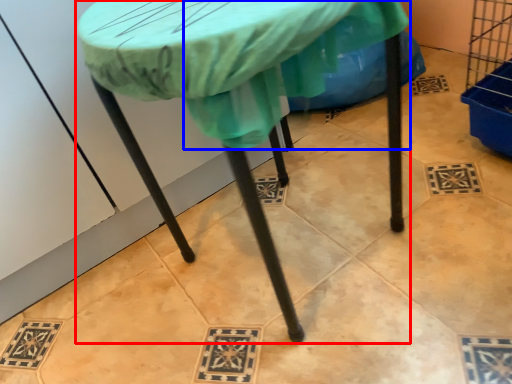
Question: Which of the following is the farthest to the observer, table (highlighted by a red box) or fabric (highlighted by a blue box)?

Choices:
 (A) table
 (B) fabric

Answer: (B)